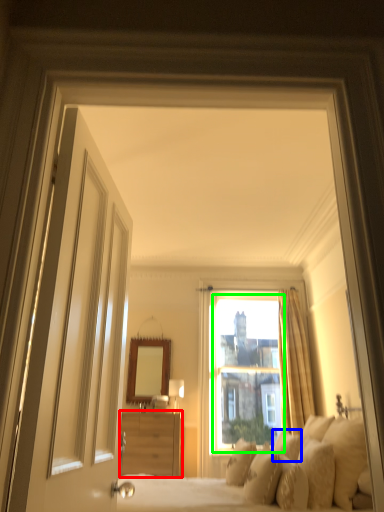
Question: Which object is the closest to the cabinetry (highlighted by a red box)? Choose among these: pillow (highlighted by a blue box) or window screen (highlighted by a green box).

Choices:
 (A) pillow
 (B) window screen

Answer: (A)